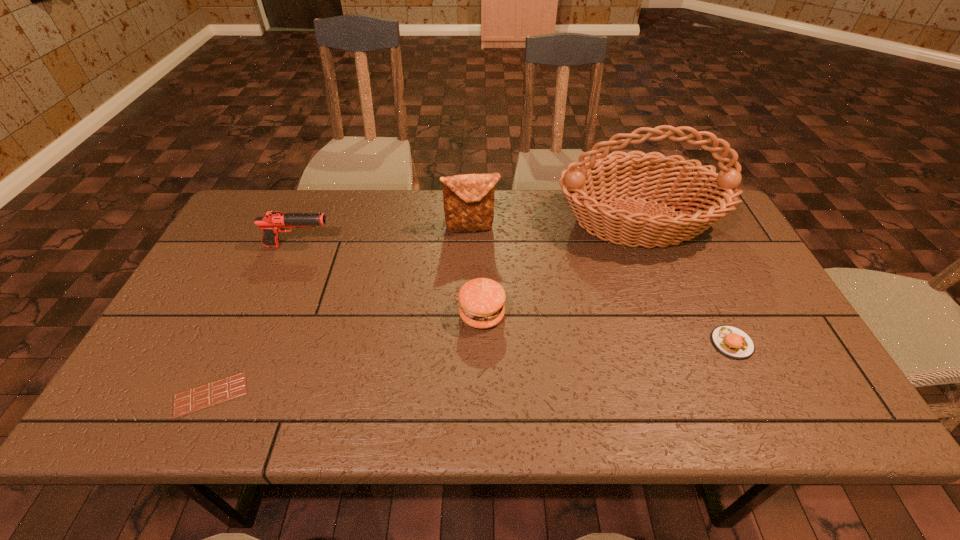
Identify the location of vacant point located between the basket and the shorter patty. The height and width of the screenshot is (540, 960). (684, 282).

The height and width of the screenshot is (540, 960). What are the coordinates of `empty space between the nearest object and the tallest object` in the screenshot? It's located at (424, 308).

Where is `free space that is in between the right patty and the tallest object`? free space that is in between the right patty and the tallest object is located at coordinates (684, 282).

Image resolution: width=960 pixels, height=540 pixels. In order to click on vacant space in between the chocolate bar and the fifth tallest object in this screenshot , I will do `click(471, 369)`.

The width and height of the screenshot is (960, 540). Find the location of `vacant area that lies between the third tallest object and the clutch bag`. vacant area that lies between the third tallest object and the clutch bag is located at coordinates (385, 237).

Locate an element on the screen. The image size is (960, 540). vacant point located between the fourth shortest object and the chocolate bar is located at coordinates (254, 320).

Find the location of a particular element. blank region between the tallest object and the left patty is located at coordinates (560, 268).

Identify the location of empty location between the clutch bag and the fourth shortest object. (385, 237).

What are the coordinates of `free space that is in between the right patty and the clutch bag` in the screenshot? It's located at (602, 286).

The image size is (960, 540). Find the location of `object that stands as the closest to the shorter patty`. object that stands as the closest to the shorter patty is located at coordinates (601, 177).